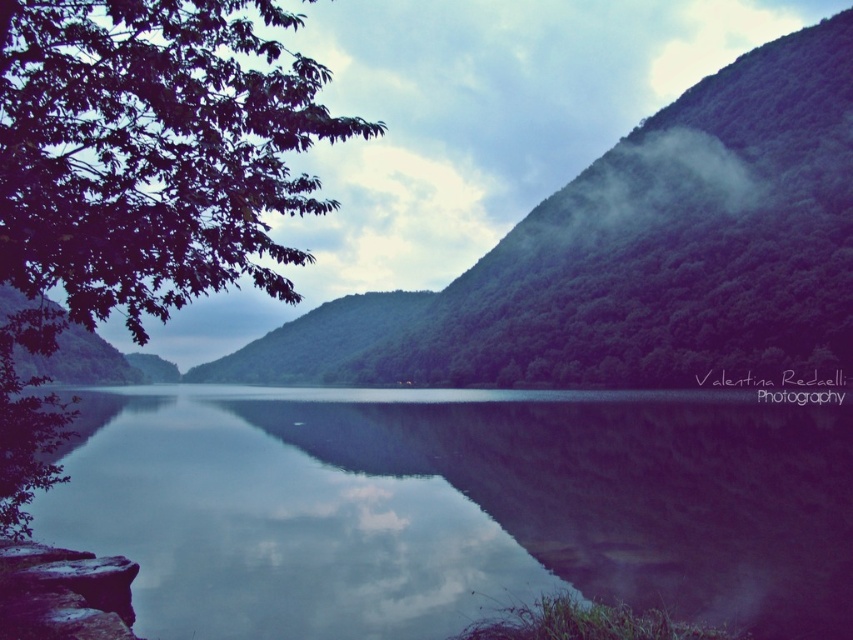
Is green leafy hillside at upper left positioned at the back of green leafy tree at left?

That is True.

Does point (787, 196) come closer to viewer compared to point (19, 396)?

No, (787, 196) is further to viewer.

You are a GUI agent. You are given a task and a screenshot of the screen. Output one action in this format:
    pyautogui.click(x=<x>, y=<y>)
    Task: Click on the green leafy hillside at upper left
    This screenshot has width=853, height=640.
    Given the screenshot: What is the action you would take?
    pyautogui.click(x=625, y=256)

Is point (720, 621) positioned before point (39, 90)?

That is False.

What do you see at coordinates (457, 508) in the screenshot? I see `glossy water at center` at bounding box center [457, 508].

Who is more distant from viewer, (619, 436) or (57, 204)?

Point (619, 436)

This screenshot has width=853, height=640. Identify the location of glossy water at center. (457, 508).

Who is higher up, glossy water at center or green leafy hillside at upper left?

green leafy hillside at upper left

Does point (662, 404) come closer to viewer compared to point (699, 369)?

Yes, point (662, 404) is closer to viewer.

Where is `glossy water at center`? The width and height of the screenshot is (853, 640). glossy water at center is located at coordinates (457, 508).